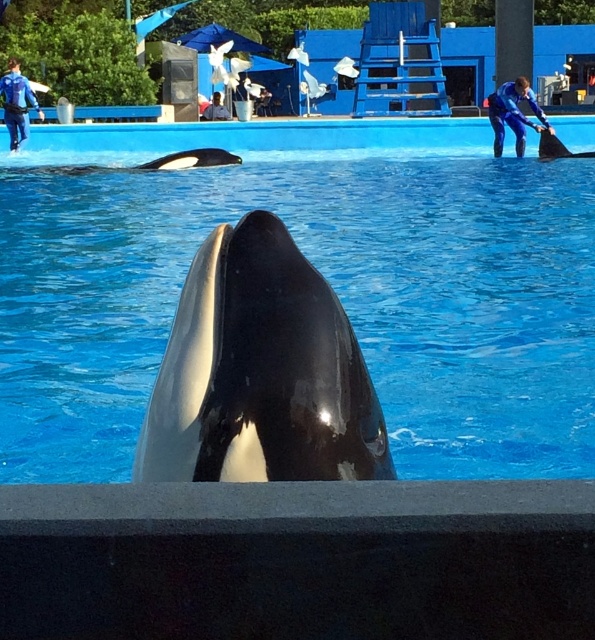
Question: Estimate the real-world distances between objects in this image. Which object is farther from the black smooth orca at center?

Choices:
 (A) black smooth dolphin at right
 (B) blue wetsuit at upper left
 (C) blue wetsuit at right

Answer: (C)

Question: Is blue wetsuit at right smaller than black smooth dolphin at right?

Choices:
 (A) no
 (B) yes

Answer: (A)

Question: Among these points, which one is nearest to the camera?

Choices:
 (A) (528, 93)
 (B) (499, 195)
 (C) (215, 92)

Answer: (B)

Question: Is blue wetsuit at upper left in front of blue rubber glove at upper center?

Choices:
 (A) no
 (B) yes

Answer: (B)

Question: Which object is positioned closest to the black glossy whale at center?

Choices:
 (A) blue wetsuit at upper left
 (B) blue wetsuit at right
 (C) blue rubber glove at upper center

Answer: (B)

Question: Is blue wetsuit at right to the left of black smooth dolphin at right from the viewer's perspective?

Choices:
 (A) yes
 (B) no

Answer: (A)